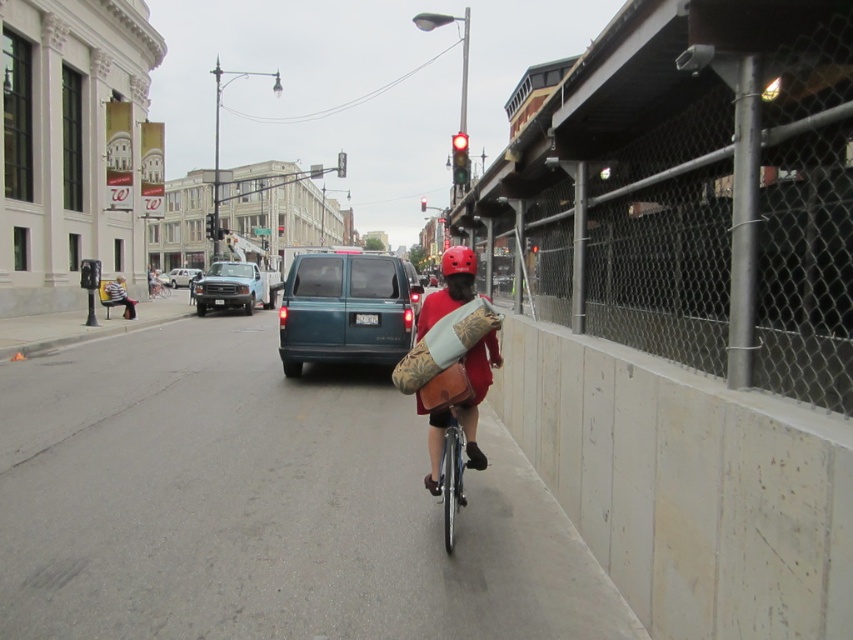
You are a delivery person planning to ride your bike through the smooth concrete bike lane at center. You notice the red matte helmet at upper center. Which object takes up more space in the image?

The smooth concrete bike lane at center takes up more space in the image than the red matte helmet at upper center because it is bigger.

You are a pedestrian standing at the crosswalk and see the matte blue truck at center and the metallic silver bicycle at center. Which one is closer to the crosswalk?

The metallic silver bicycle at center is closer to the crosswalk because the matte blue truck at center is to the right of it, meaning the bicycle is positioned between the crosswalk and the truck.